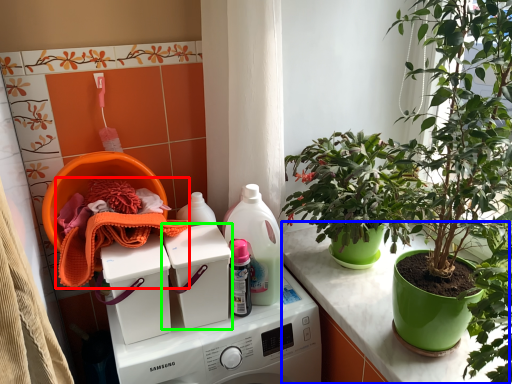
Question: Based on their relative distances, which object is farther from material (highlighted by a red box)? Choose from counter (highlighted by a blue box) and washing machine (highlighted by a green box).

Choices:
 (A) counter
 (B) washing machine

Answer: (A)